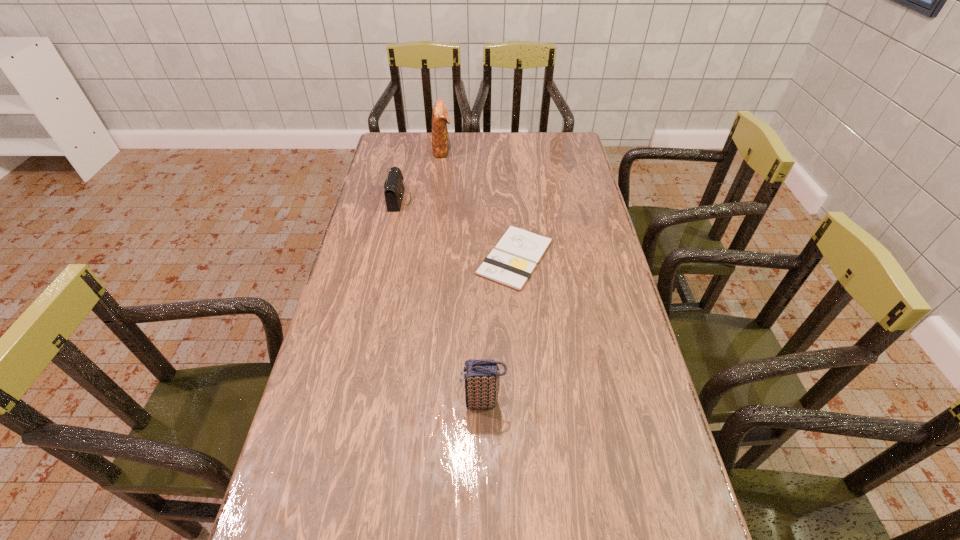
Locate an element on the screen. This screenshot has width=960, height=540. vacant region located 0.080m with the zip open on the rightmost clutch bag is located at coordinates (428, 402).

The height and width of the screenshot is (540, 960). What are the coordinates of `free space located 0.310m with the zip open on the rightmost clutch bag` in the screenshot? It's located at (330, 402).

You are a GUI agent. You are given a task and a screenshot of the screen. Output one action in this format:
    pyautogui.click(x=<x>, y=<y>)
    Task: Click on the vacant space located 0.060m on the front flap of the second farthest clutch bag
    The image size is (960, 540).
    Given the screenshot: What is the action you would take?
    pyautogui.click(x=428, y=200)

Identify the location of blank area located 0.290m on the back of the third farthest object. The image size is (960, 540). (509, 179).

Locate an element on the screen. This screenshot has width=960, height=540. object at the far edge is located at coordinates (440, 118).

The image size is (960, 540). Identify the location of object located at the left edge. (394, 188).

The width and height of the screenshot is (960, 540). Identify the location of free point at the far edge. (508, 133).

Find the location of `free location at the left edge`. free location at the left edge is located at coordinates (324, 384).

Locate an element on the screen. The image size is (960, 540). vacant space at the right edge of the desktop is located at coordinates pos(583,252).

In the image, there is a desktop. Where is `vacant space at the far left corner`? vacant space at the far left corner is located at coordinates [415, 131].